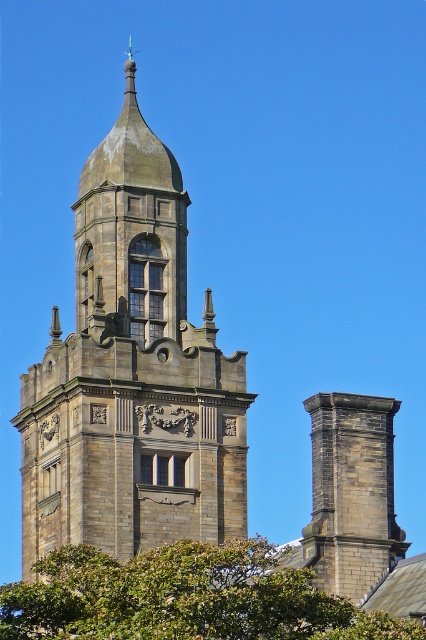
Question: From the image, what is the correct spatial relationship of stone tower at center in relation to green leafy tree at lower center?

Choices:
 (A) below
 (B) above

Answer: (B)

Question: Which of the following is the farthest from the observer?

Choices:
 (A) green leafy tree at lower center
 (B) stone tower at center

Answer: (B)

Question: Is stone tower at center positioned behind green leafy tree at lower center?

Choices:
 (A) no
 (B) yes

Answer: (B)

Question: Does stone tower at center have a smaller size compared to green leafy tree at lower center?

Choices:
 (A) yes
 (B) no

Answer: (B)